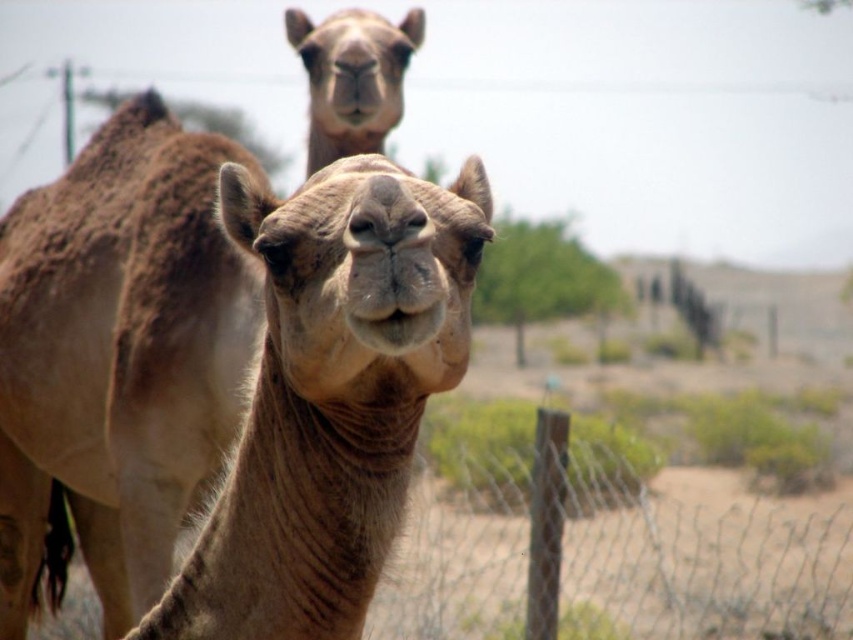
You are a photographer trying to capture both the brown textured camel at center and the wire mesh at lower right in your shot. Based on their widths, which one should you adjust your camera focus to prioritize for a clearer image?

The wire mesh at lower right is wider than the brown textured camel at center, so you should prioritize focusing on the wire mesh at lower right to ensure it appears clearer in the photo.

You are a photographer trying to capture both the brown textured camel at center and the wire mesh at lower right in your shot. Based on their sizes in the image, which one would appear larger in your photograph?

The wire mesh at lower right appears larger in the photograph because the brown textured camel at center is smaller than it.